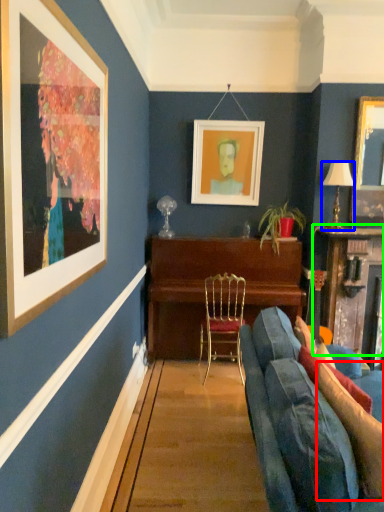
Question: Which is farther away from pillow (highlighted by a red box)? lamp (highlighted by a blue box) or table (highlighted by a green box)?

Choices:
 (A) lamp
 (B) table

Answer: (A)